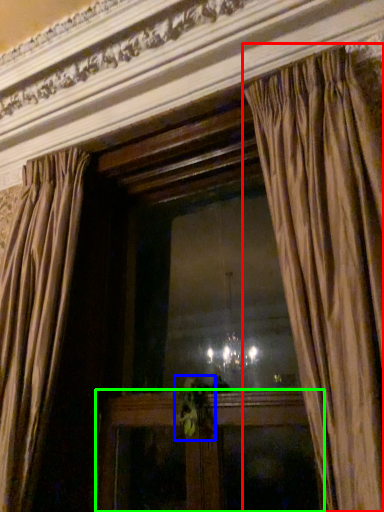
Question: Which object is the closest to the curtain (highlighted by a red box)? Choose among these: plant (highlighted by a blue box) or furniture (highlighted by a green box).

Choices:
 (A) plant
 (B) furniture

Answer: (B)